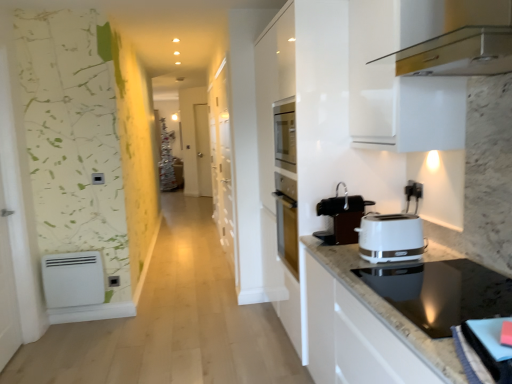
Question: From a real-world perspective, is black plastic electric outlet at lower left, the first electric outlet when ordered from left to right, above or below metallic gold range hood at upper right, the second home appliance in the bottom-to-top sequence?

Choices:
 (A) below
 (B) above

Answer: (A)

Question: From the image's perspective, is black plastic electric outlet at lower left, placed as the 1th electric outlet when sorted from back to front, positioned above or below metallic gold range hood at upper right, the second home appliance in the bottom-to-top sequence?

Choices:
 (A) above
 (B) below

Answer: (B)

Question: Which of these objects is positioned farthest from the white matte heater at lower left?

Choices:
 (A) black plastic coffee machine at center
 (B) black plastic electric outlet at upper right, arranged as the second electric outlet when ordered from the bottom
 (C) white glossy toaster at right
 (D) white glossy cabinet at center
 (E) metallic gold range hood at upper right, the first home appliance positioned from the top

Answer: (D)

Question: Estimate the real-world distances between objects in this image. Which object is closer to the black glass cooktop at lower right, the second home appliance when ordered from top to bottom?

Choices:
 (A) black plastic electric outlet at lower left, placed as the 1th electric outlet when sorted from back to front
 (B) metallic gold range hood at upper right, the second home appliance in the bottom-to-top sequence
 (C) white glossy toaster at right
 (D) black plastic electric outlet at upper right, positioned as the first electric outlet in top-to-bottom order
 (E) black plastic coffee machine at center

Answer: (C)